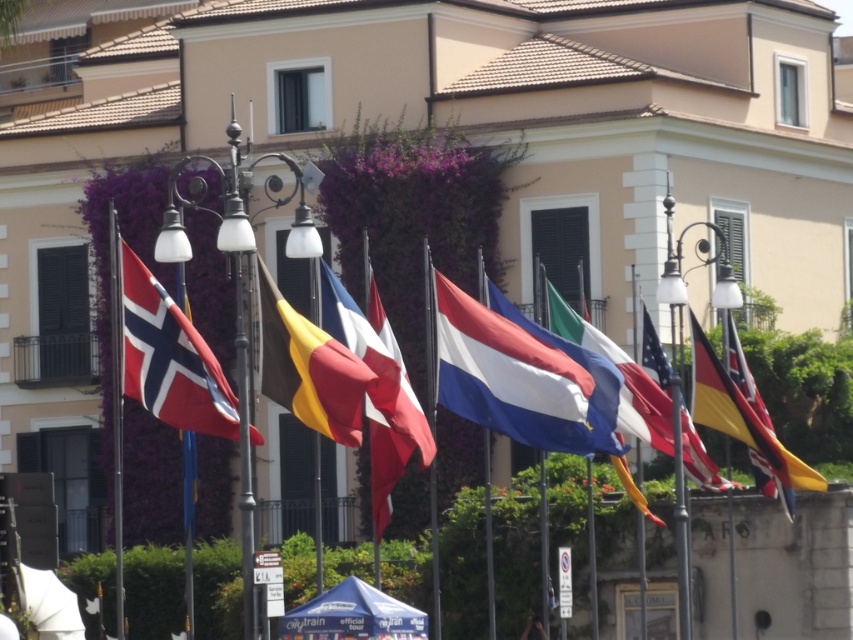
You are a photographer standing in front of the row of flags in front of the beige building. You want to capture a photo where both the red and white fabric flag at left and the yellow and black striped flag at center are clearly visible. Which flag should you focus on first to ensure both are in frame?

The red and white fabric flag at left is shorter than the yellow and black striped flag at center, so you should focus on the yellow and black striped flag at center first to ensure both are in frame.

You are standing in front of the row of flags in front of the beige building. You notice the white fabric flag at center and the polished silver flag at right. Which flag is positioned higher in the arrangement?

The white fabric flag at center is located above the polished silver flag at right, so it is positioned higher in the arrangement.

You are a photographer standing 10 meters away from the row of flags. You want to capture both the red and white fabric flag at left and the yellow and black striped flag at center in a single photo without moving. Can you do it?

The red and white fabric flag at left and yellow and black striped flag at center are 16.76 meters apart from each other. Since you are 10 meters away from the flags, the distance between the two flags is wider than your field of view, so you cannot capture both in a single photo without moving.